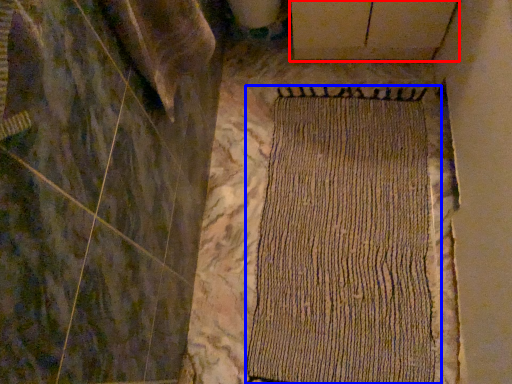
Question: Which point is closer to the camera, plywood (highlighted by a red box) or mat (highlighted by a blue box)?

Choices:
 (A) plywood
 (B) mat

Answer: (B)